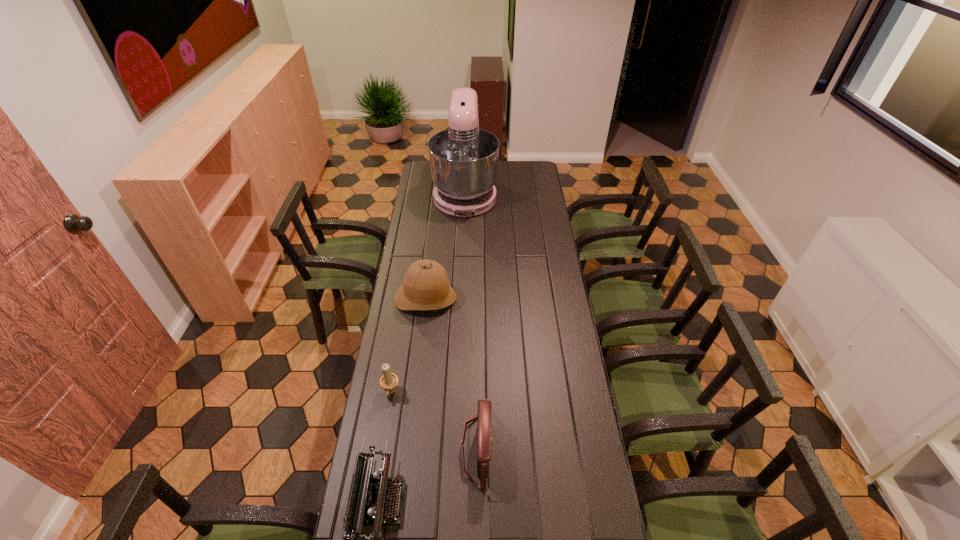
Identify the location of mixer. The width and height of the screenshot is (960, 540). (463, 159).

The height and width of the screenshot is (540, 960). Find the location of `the tallest object`. the tallest object is located at coordinates (463, 159).

Where is `the fourth nearest object`? the fourth nearest object is located at coordinates (426, 286).

Identify the location of hat. This screenshot has width=960, height=540. (426, 286).

Find the location of a particular element. The height and width of the screenshot is (540, 960). the third farthest object is located at coordinates (388, 381).

What are the coordinates of `shoulder bag` in the screenshot? It's located at (484, 440).

Locate an element on the screen. The height and width of the screenshot is (540, 960). free location located on the front-facing side of the tallest object is located at coordinates (462, 272).

At what (x,y) coordinates should I click in order to perform the action: click on blank space located on the front-facing side of the fourth nearest object. Please return your answer as a coordinate pair (x, y). This screenshot has height=540, width=960. Looking at the image, I should click on (414, 395).

The width and height of the screenshot is (960, 540). I want to click on vacant space located 0.360m on the handle side of the candle_holder, so click(372, 511).

Where is `free point located 0.280m on the front flap of the shoulder bag`? The height and width of the screenshot is (540, 960). free point located 0.280m on the front flap of the shoulder bag is located at coordinates (576, 449).